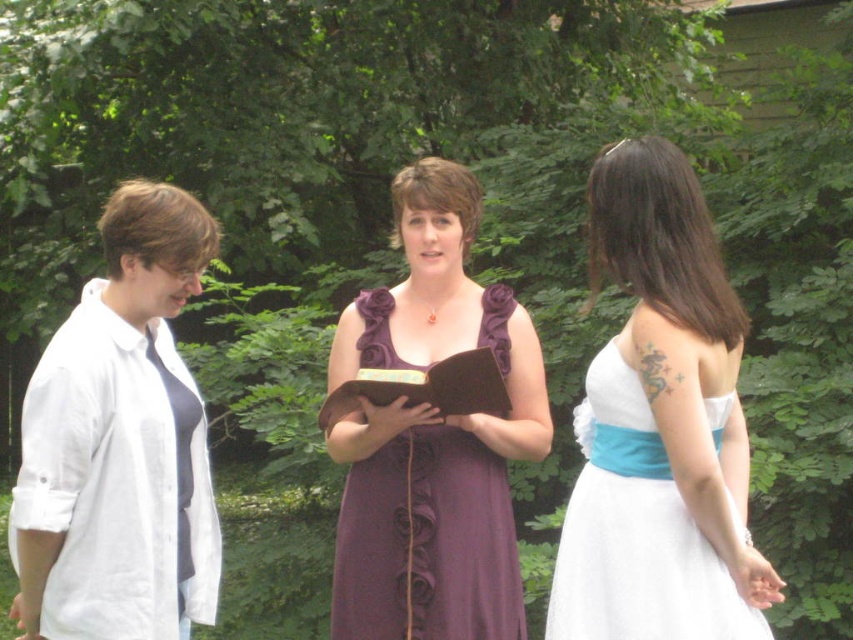
You are standing in a garden and see a point marked at coordinates (405,618). If you want to place a 2.5 meter long bench here, will it fit without overlapping any existing objects?

The point at (405,618) is 3.51 meters from the viewer, so placing a 2.5 meter long bench there would be possible as the distance is sufficient.